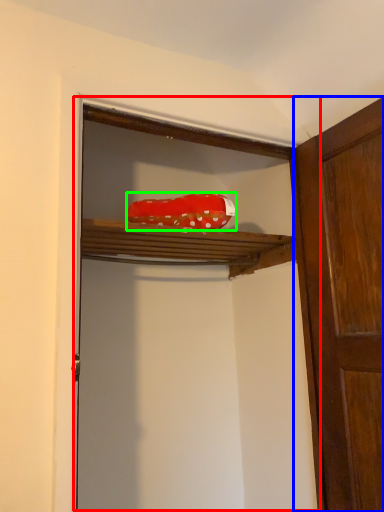
Question: Estimate the real-world distances between objects in this image. Which object is closer to cabinetry (highlighted by a red box), door (highlighted by a blue box) or material (highlighted by a green box)?

Choices:
 (A) door
 (B) material

Answer: (A)